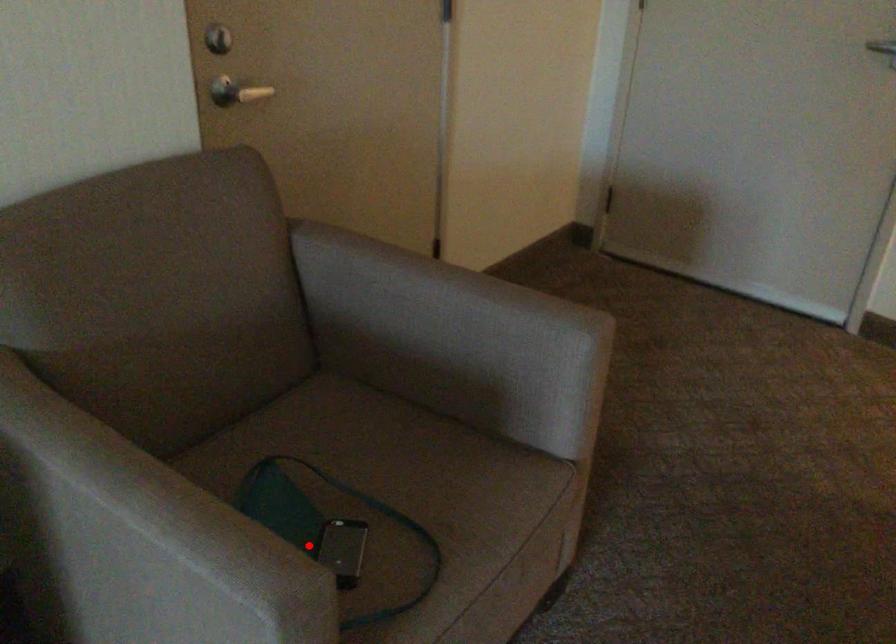
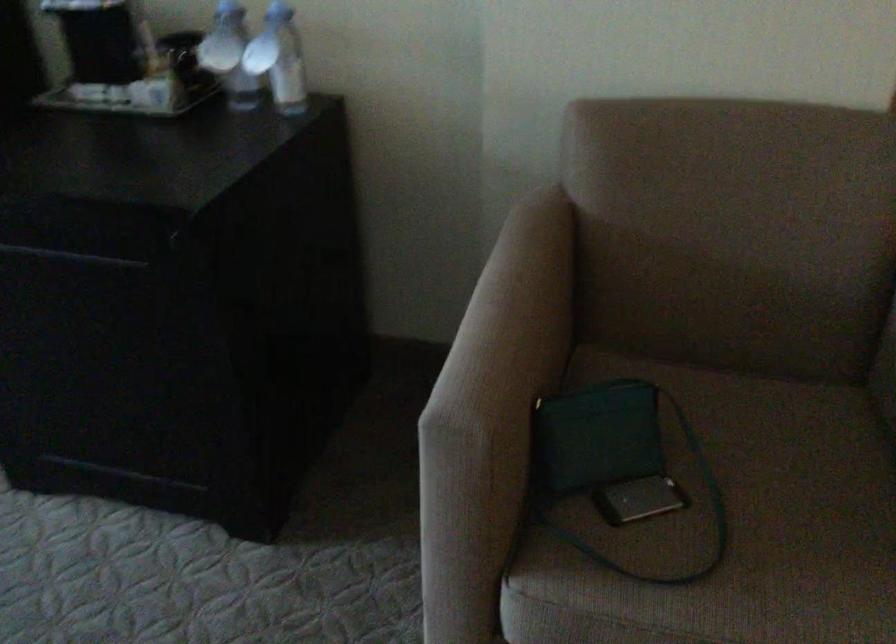
Question: I am providing you with two images of the same scene from different viewpoints. A red point is marked on the first image. Is the red point's position out of view in image 2?

Choices:
 (A) Yes
 (B) No

Answer: (B)